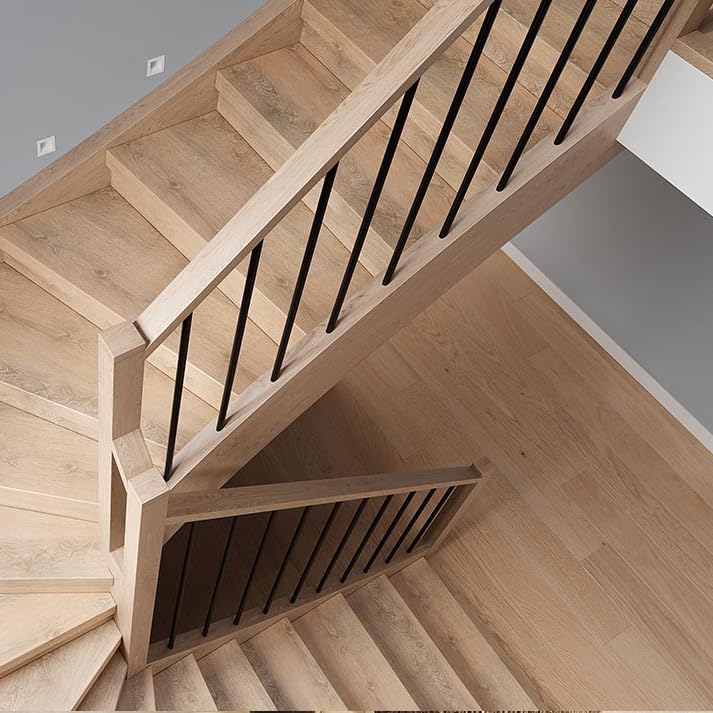
At what (x,y) coordinates should I click in order to perform the action: click on bottom baluster. Please return your answer as a coordinate pair (x, y). The image size is (713, 713). Looking at the image, I should click on (182, 580), (215, 578), (250, 574), (277, 568), (307, 560), (331, 560), (354, 550), (388, 533), (404, 527), (426, 523).